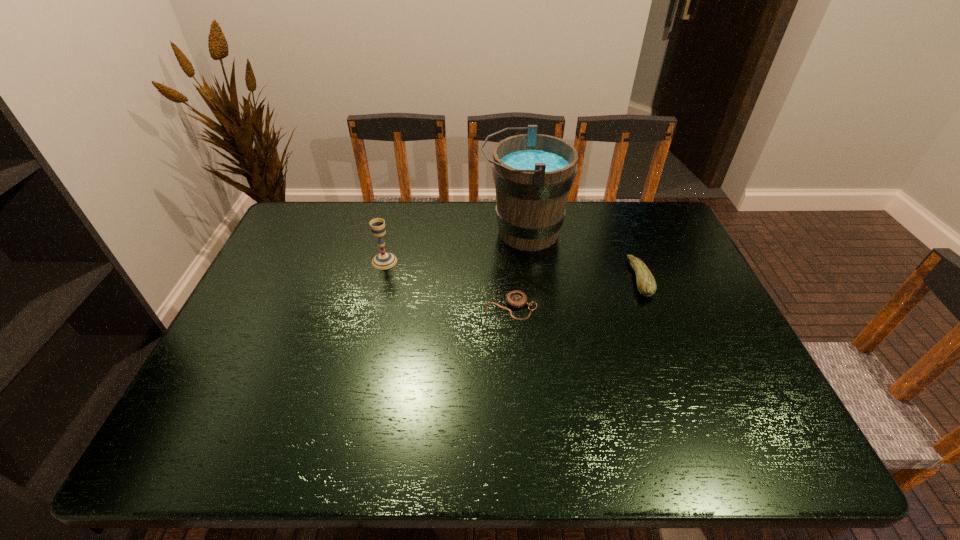
This screenshot has height=540, width=960. I want to click on the tallest object, so click(x=533, y=173).

Find the location of a particular element. The image size is (960, 540). the second tallest object is located at coordinates (384, 260).

Identify the location of chalice. Image resolution: width=960 pixels, height=540 pixels. (384, 260).

This screenshot has height=540, width=960. I want to click on zucchini, so click(x=646, y=284).

Locate an element on the screen. The height and width of the screenshot is (540, 960). the third tallest object is located at coordinates (646, 284).

Locate an element on the screen. Image resolution: width=960 pixels, height=540 pixels. the shortest object is located at coordinates (516, 299).

Find the location of a particular element. This screenshot has width=960, height=540. free spot located 0.310m with a handle on the side of the wine bucket is located at coordinates (386, 232).

This screenshot has width=960, height=540. Find the location of `free location located with a handle on the side of the wine bucket`. free location located with a handle on the side of the wine bucket is located at coordinates (420, 232).

Where is `free space located with a handle on the side of the wine bucket`? The height and width of the screenshot is (540, 960). free space located with a handle on the side of the wine bucket is located at coordinates (465, 232).

In order to click on free region located 0.300m on the front of the second tallest object in this screenshot , I will do `click(363, 351)`.